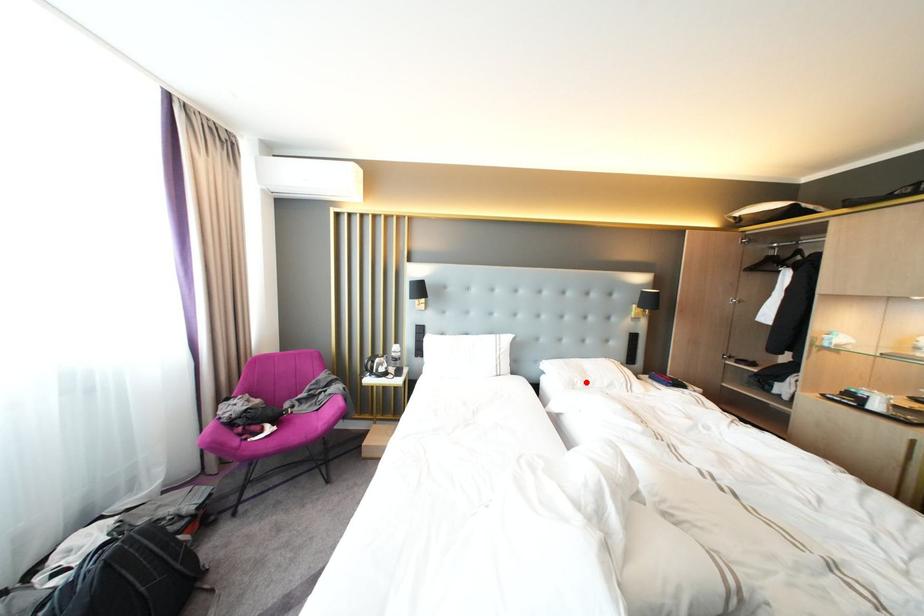
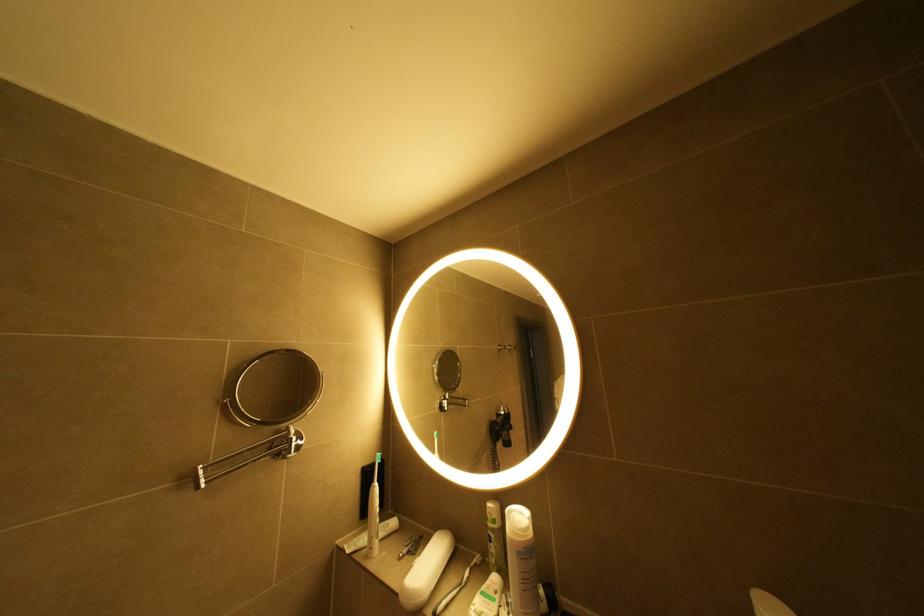
Question: I am providing you with two images of the same scene from different viewpoints. A red point is marked on the first image. Can you still see the location of the red point in image 2?

Choices:
 (A) Yes
 (B) No

Answer: (B)